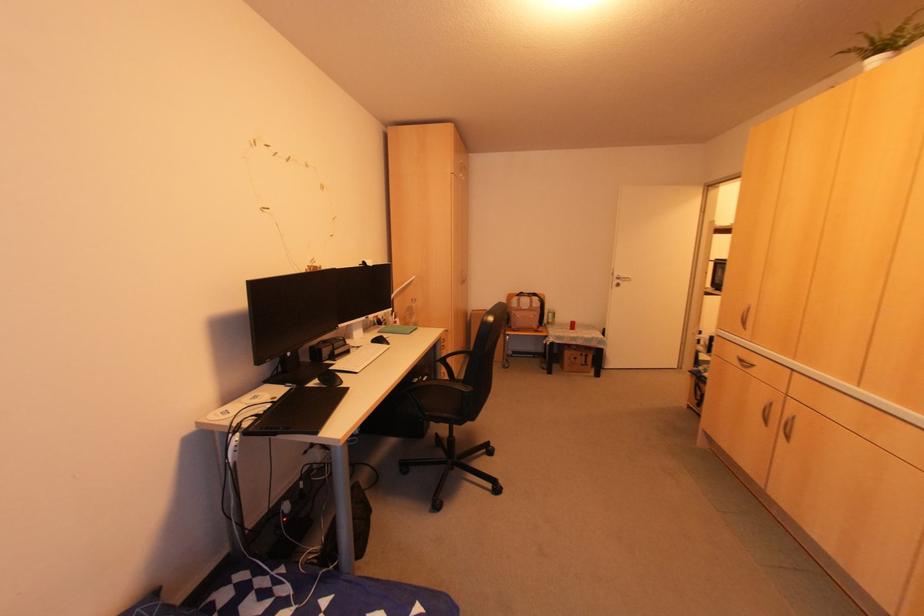
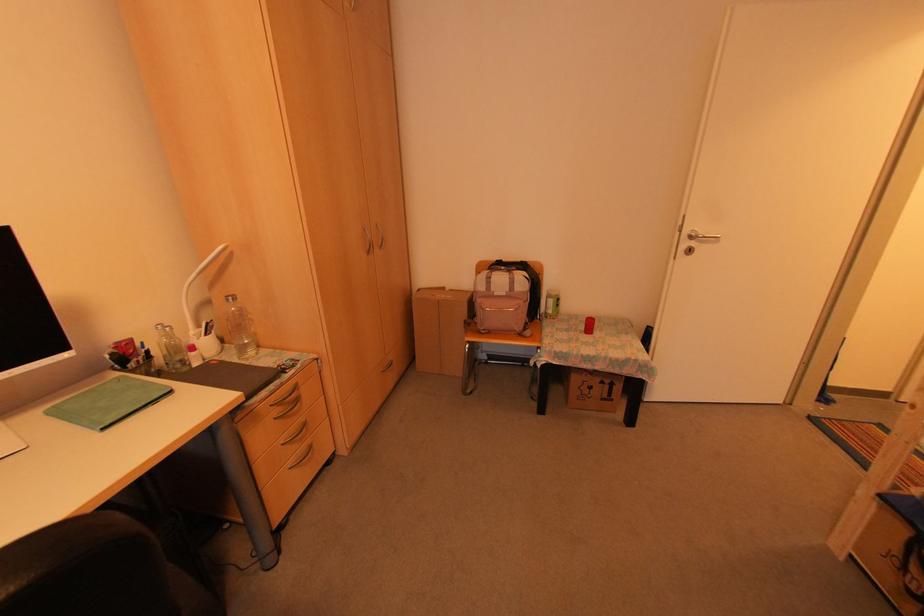
The point at (615, 285) is marked in the first image. Where is the corresponding point in the second image?

(687, 251)